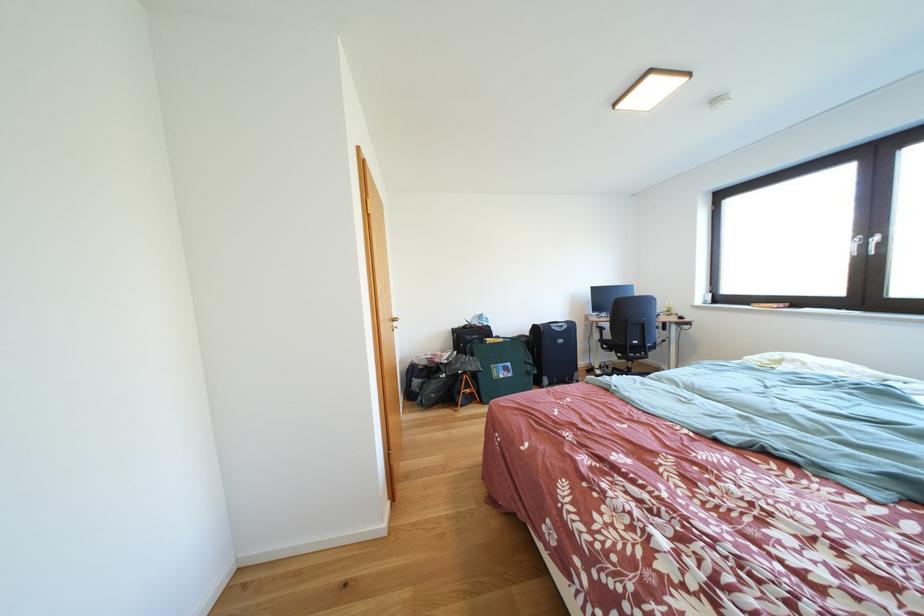
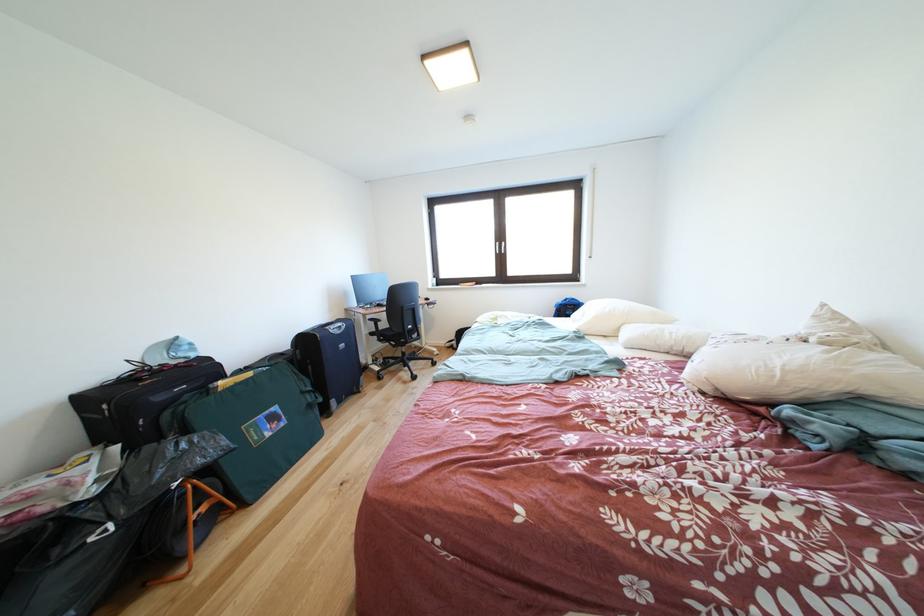
Find the pixel in the second image that matches point 511,345 in the first image.

(259, 379)